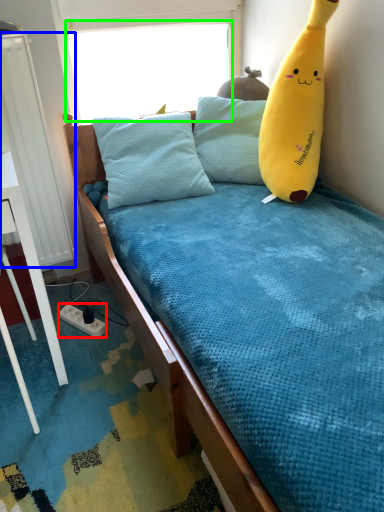
Question: Considering the real-world distances, which object is closest to power outlet (highlighted by a red box)? radiator (highlighted by a blue box) or window screen (highlighted by a green box).

Choices:
 (A) radiator
 (B) window screen

Answer: (A)